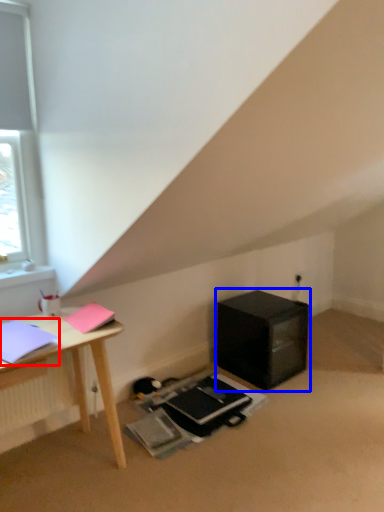
Question: Which object is further to the camera taking this photo, notebook (highlighted by a red box) or nightstand (highlighted by a blue box)?

Choices:
 (A) notebook
 (B) nightstand

Answer: (B)